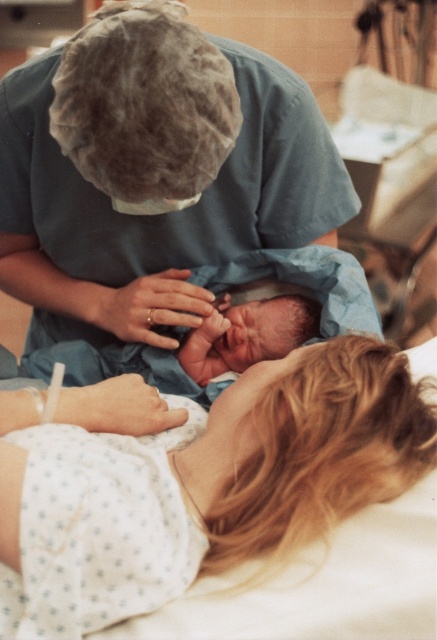
Does white dotted fabric at lower left appear on the right side of matte blue scrubs at center?

Indeed, white dotted fabric at lower left is positioned on the right side of matte blue scrubs at center.

Is white dotted fabric at lower left closer to camera compared to matte blue scrubs at center?

Yes, white dotted fabric at lower left is in front of matte blue scrubs at center.

You are a GUI agent. You are given a task and a screenshot of the screen. Output one action in this format:
    pyautogui.click(x=<x>, y=<y>)
    Task: Click on the white dotted fabric at lower left
    
    Given the screenshot: What is the action you would take?
    click(215, 502)

The image size is (437, 640). Identify the location of white dotted fabric at lower left. (215, 502).

Which is above, white dotted fabric at lower left or smooth skin newborn at center?

smooth skin newborn at center is above.

Is point (319, 605) positioned in front of point (267, 333)?

Yes, point (319, 605) is closer to viewer.

Measure the distance between white dotted fabric at lower left and camera.

31.21 inches

Where is `white dotted fabric at lower left`? This screenshot has height=640, width=437. white dotted fabric at lower left is located at coordinates (215, 502).

Is matte blue scrubs at center shorter than smooth skin newborn at center?

Incorrect, matte blue scrubs at center's height does not fall short of smooth skin newborn at center's.

What are the coordinates of `matte blue scrubs at center` in the screenshot? It's located at (162, 214).